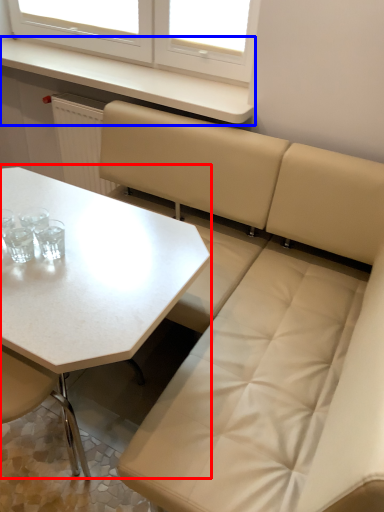
Question: Among these objects, which one is farthest to the camera, table (highlighted by a red box) or counter top (highlighted by a blue box)?

Choices:
 (A) table
 (B) counter top

Answer: (B)